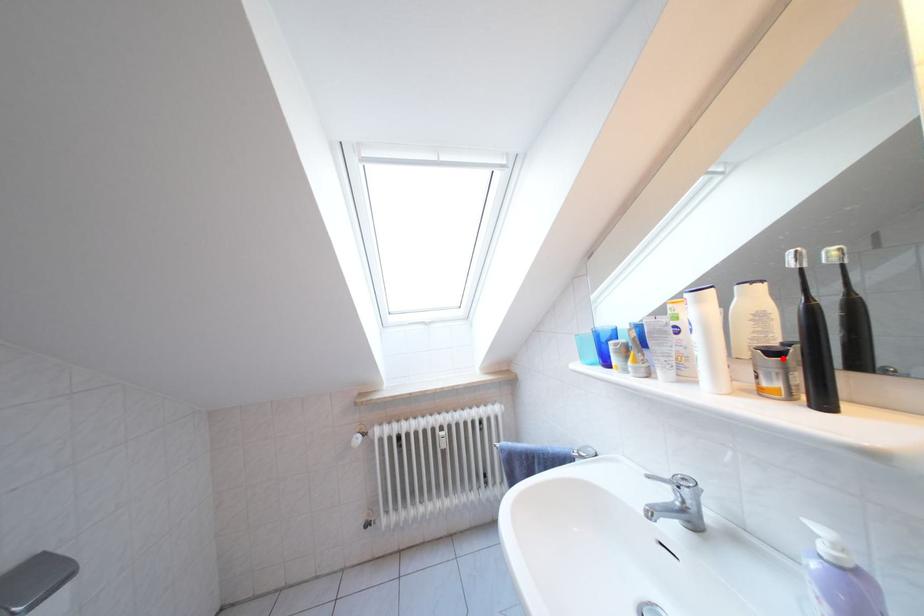
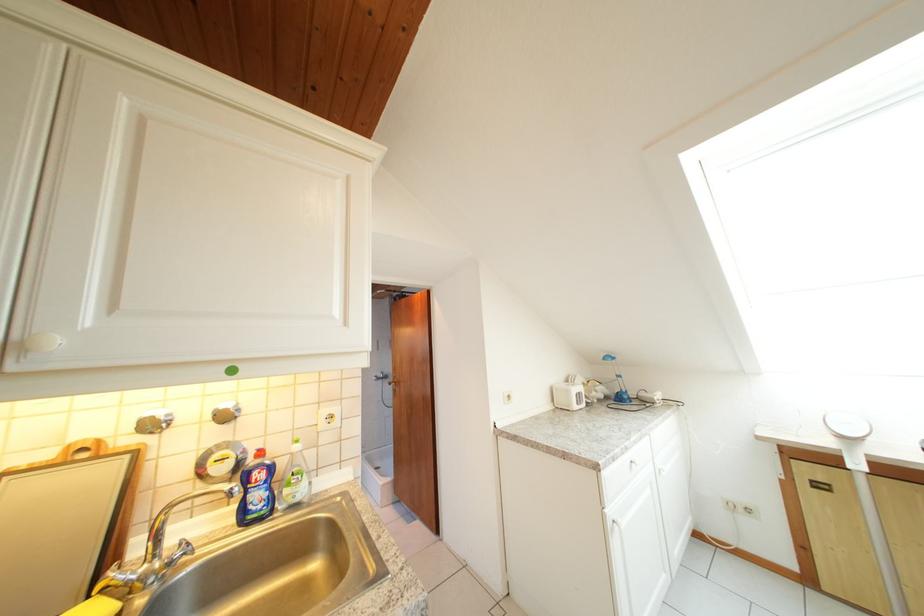
Question: I am providing you with two images of the same scene from different viewpoints. A red point is marked on the first image. Is the red point's position out of view in image 2?

Choices:
 (A) Yes
 (B) No

Answer: (A)